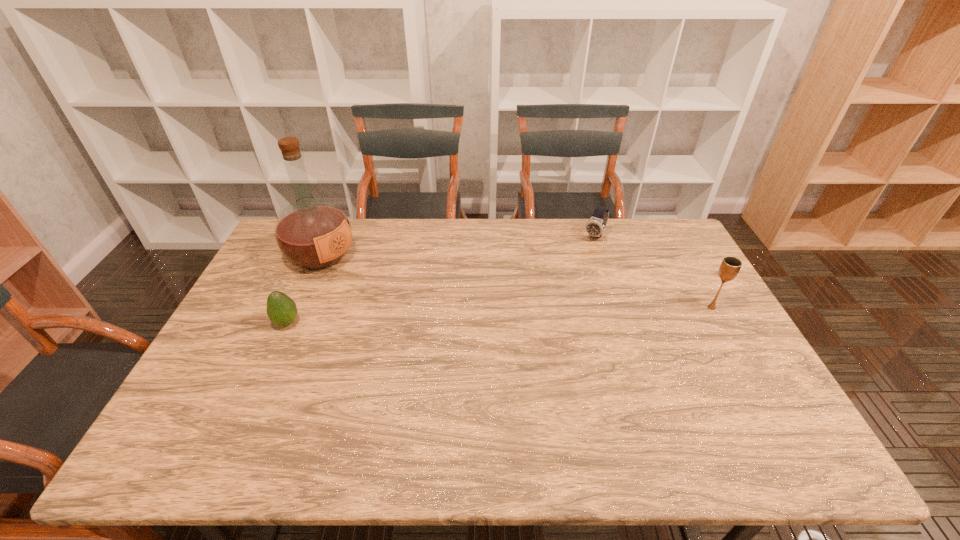
Where is `vacant spot on the desktop that is between the nearest object and the third farthest object and is positioned on the front label of the liquor`? The image size is (960, 540). vacant spot on the desktop that is between the nearest object and the third farthest object and is positioned on the front label of the liquor is located at coordinates (442, 317).

Find the location of a particular element. The image size is (960, 540). vacant space on the desktop that is between the avocado and the chalice and is positioned on the face of the watch is located at coordinates (541, 313).